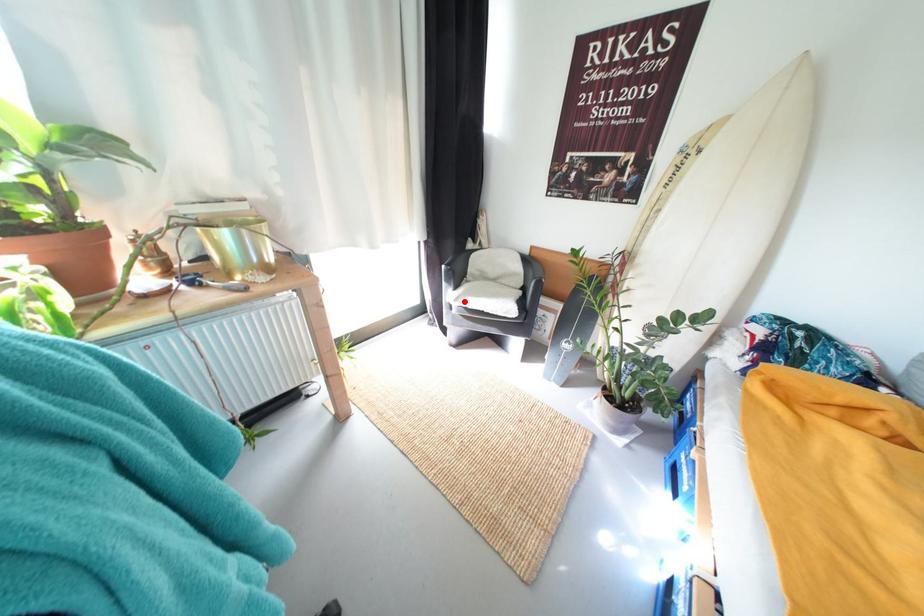
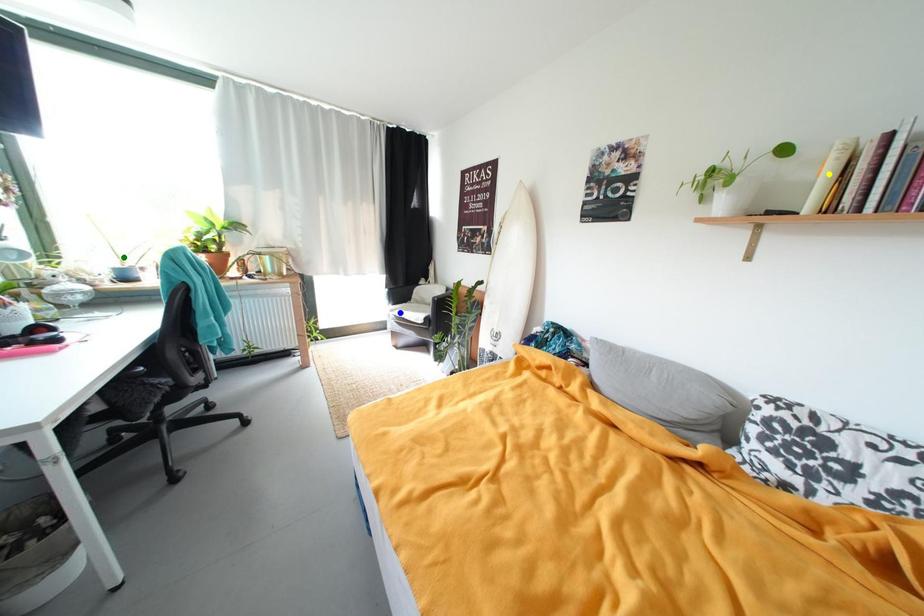
Question: I am providing you with two images of the same scene from different viewpoints. A red point is marked on the first image. You are given multiple points on the second image. In image 2, which mark is for the same physical point as the one in image 1?

Choices:
 (A) green point
 (B) blue point
 (C) yellow point

Answer: (B)